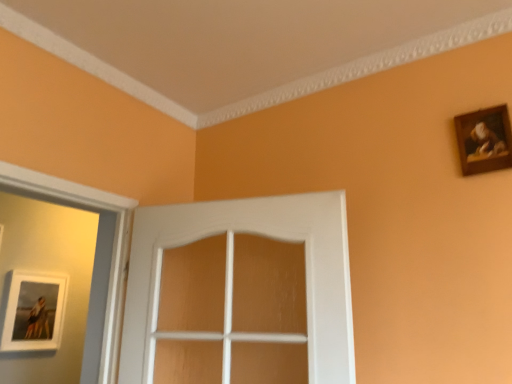
What are the coordinates of `white wood door at center` in the screenshot? It's located at (231, 244).

Which is behind, wooden frame at upper right, the 2th picture frame when ordered from bottom to top, or matte white picture frame at lower left, positioned as the second picture frame in top-to-bottom order?

matte white picture frame at lower left, positioned as the second picture frame in top-to-bottom order, is behind.

Which of these two, wooden frame at upper right, which is counted as the first picture frame, starting from the front, or matte white picture frame at lower left, positioned as the second picture frame in top-to-bottom order, stands shorter?

With less height is wooden frame at upper right, which is counted as the first picture frame, starting from the front.

From a real-world perspective, which object stands above the other?

From a 3D spatial view, wooden frame at upper right, which is the 2th picture frame from back to front, is above.

Would you say white wood door at center is a long distance from wooden frame at upper right, placed as the first picture frame when sorted from right to left?

No.

How many degrees apart are the facing directions of white wood door at center and wooden frame at upper right, which is the second picture frame in left-to-right order?

The angle between the facing direction of white wood door at center and the facing direction of wooden frame at upper right, which is the second picture frame in left-to-right order, is 15.5 degrees.

Is white wood door at center in front of or behind wooden frame at upper right, the 2th picture frame when ordered from bottom to top, in the image?

white wood door at center is in front of wooden frame at upper right, the 2th picture frame when ordered from bottom to top.

Which is farther, (229, 332) or (498, 164)?

The point (229, 332) is farther from the camera.

Is matte white picture frame at lower left, which is counted as the 2th picture frame, starting from the right, not within white wood door at center?

That's correct, matte white picture frame at lower left, which is counted as the 2th picture frame, starting from the right, is outside of white wood door at center.

Is the surface of matte white picture frame at lower left, the 2th picture frame viewed from the front, in direct contact with white wood door at center?

They are not placed beside each other.

Would you say matte white picture frame at lower left, which is the first picture frame from bottom to top, is to the left or to the right of white wood door at center in the picture?

Clearly, matte white picture frame at lower left, which is the first picture frame from bottom to top, is on the left of white wood door at center in the image.

Is matte white picture frame at lower left, positioned as the second picture frame in top-to-bottom order, positioned with its back to white wood door at center?

No.

Based on their sizes in the image, would you say wooden frame at upper right, which is counted as the first picture frame, starting from the front, is bigger or smaller than white wood door at center?

In the image, wooden frame at upper right, which is counted as the first picture frame, starting from the front, appears to be smaller than white wood door at center.

Which point is more forward, (x=503, y=146) or (x=338, y=204)?

The point (x=503, y=146) is closer.

Between wooden frame at upper right, the first picture frame viewed from the top, and white wood door at center, which one is positioned behind?

wooden frame at upper right, the first picture frame viewed from the top, is more distant.

Image resolution: width=512 pixels, height=384 pixels. What are the coordinates of `door that appears below the wooden frame at upper right, which is the 2th picture frame from back to front (from a real-world perspective)` in the screenshot? It's located at (231, 244).

Which object is more forward, matte white picture frame at lower left, the 1th picture frame when ordered from left to right, or wooden frame at upper right, which is counted as the first picture frame, starting from the front?

wooden frame at upper right, which is counted as the first picture frame, starting from the front, is more forward.

Is matte white picture frame at lower left, the 2th picture frame viewed from the front, facing away from wooden frame at upper right, the first picture frame viewed from the top?

matte white picture frame at lower left, the 2th picture frame viewed from the front, does not have its back to wooden frame at upper right, the first picture frame viewed from the top.

Considering the relative sizes of matte white picture frame at lower left, the 1th picture frame when ordered from left to right, and wooden frame at upper right, which is counted as the first picture frame, starting from the front, in the image provided, is matte white picture frame at lower left, the 1th picture frame when ordered from left to right, taller than wooden frame at upper right, which is counted as the first picture frame, starting from the front,?

Yes.

Locate an element on the screen. picture frame that is on the left side of wooden frame at upper right, the 2th picture frame when ordered from bottom to top is located at coordinates (34, 311).

How many degrees apart are the facing directions of white wood door at center and matte white picture frame at lower left, which ranks as the 1th picture frame in back-to-front order?

The angle between the facing direction of white wood door at center and the facing direction of matte white picture frame at lower left, which ranks as the 1th picture frame in back-to-front order, is 74.3 degrees.

This screenshot has width=512, height=384. I want to click on picture frame to the left of white wood door at center, so click(x=34, y=311).

Looking at this image, from the image's perspective, which is above, white wood door at center or matte white picture frame at lower left, which ranks as the 1th picture frame in back-to-front order?

white wood door at center appears higher in the image.

The height and width of the screenshot is (384, 512). What are the coordinates of `picture frame below the wooden frame at upper right, placed as the first picture frame when sorted from right to left (from the image's perspective)` in the screenshot? It's located at (34, 311).

Locate an element on the screen. Image resolution: width=512 pixels, height=384 pixels. door that is under the wooden frame at upper right, placed as the first picture frame when sorted from right to left (from a real-world perspective) is located at coordinates (231, 244).

When comparing their distances from matte white picture frame at lower left, the 2th picture frame viewed from the front, does wooden frame at upper right, placed as the first picture frame when sorted from right to left, or white wood door at center seem closer?

white wood door at center is positioned closer to the anchor matte white picture frame at lower left, the 2th picture frame viewed from the front.

From the image, which object appears to be farther from wooden frame at upper right, which is the 2th picture frame from back to front, white wood door at center or matte white picture frame at lower left, the 2th picture frame viewed from the front?

matte white picture frame at lower left, the 2th picture frame viewed from the front, is positioned further to the anchor wooden frame at upper right, which is the 2th picture frame from back to front.

Based on their spatial positions, is matte white picture frame at lower left, which is the first picture frame from bottom to top, or white wood door at center further from wooden frame at upper right, which is the 2th picture frame from back to front?

The object further to wooden frame at upper right, which is the 2th picture frame from back to front, is matte white picture frame at lower left, which is the first picture frame from bottom to top.

When comparing their distances from white wood door at center, does matte white picture frame at lower left, the 2th picture frame viewed from the front, or wooden frame at upper right, the first picture frame viewed from the top, seem further?

matte white picture frame at lower left, the 2th picture frame viewed from the front, is positioned further to the anchor white wood door at center.

Consider the image. Considering their positions, is wooden frame at upper right, which is counted as the first picture frame, starting from the front, positioned further to white wood door at center than matte white picture frame at lower left, which ranks as the 1th picture frame in back-to-front order?

matte white picture frame at lower left, which ranks as the 1th picture frame in back-to-front order.

Based on their spatial positions, is white wood door at center or wooden frame at upper right, placed as the first picture frame when sorted from right to left, further from matte white picture frame at lower left, the 1th picture frame when ordered from left to right?

wooden frame at upper right, placed as the first picture frame when sorted from right to left, is positioned further to the anchor matte white picture frame at lower left, the 1th picture frame when ordered from left to right.

Where is `door located between matte white picture frame at lower left, which is the first picture frame from bottom to top, and wooden frame at upper right, which is the 2th picture frame from back to front, in the left-right direction`? This screenshot has width=512, height=384. door located between matte white picture frame at lower left, which is the first picture frame from bottom to top, and wooden frame at upper right, which is the 2th picture frame from back to front, in the left-right direction is located at coordinates (231, 244).